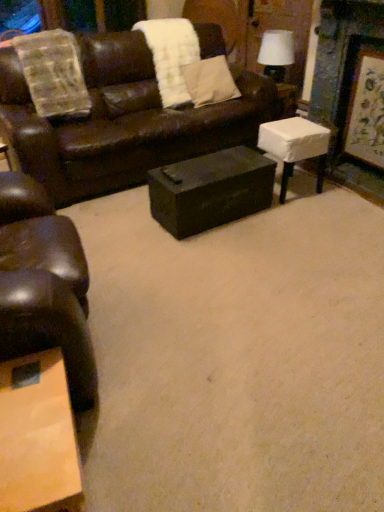
This screenshot has width=384, height=512. Find the location of `free point above wooden coffee table at lower left (from a real-world perspective)`. free point above wooden coffee table at lower left (from a real-world perspective) is located at coordinates pos(27,422).